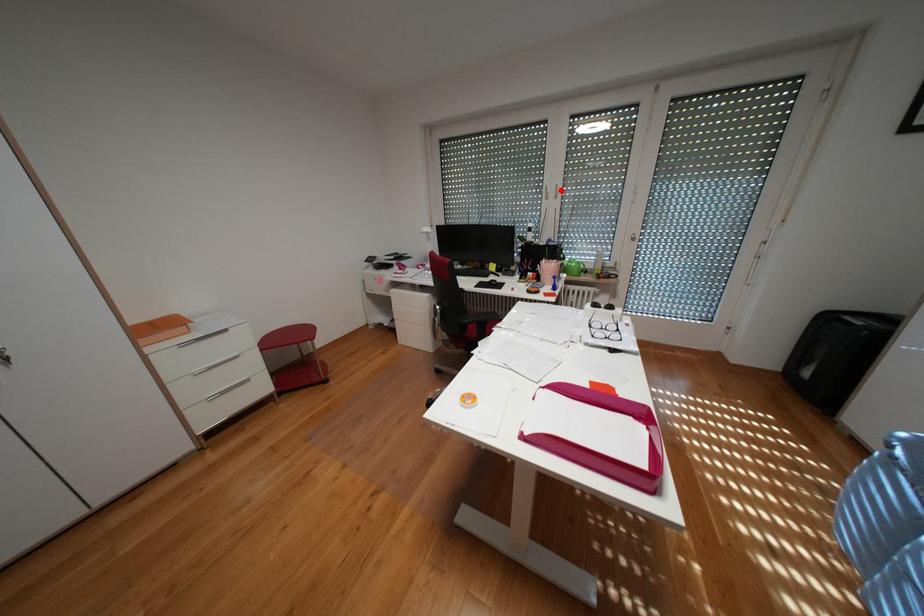
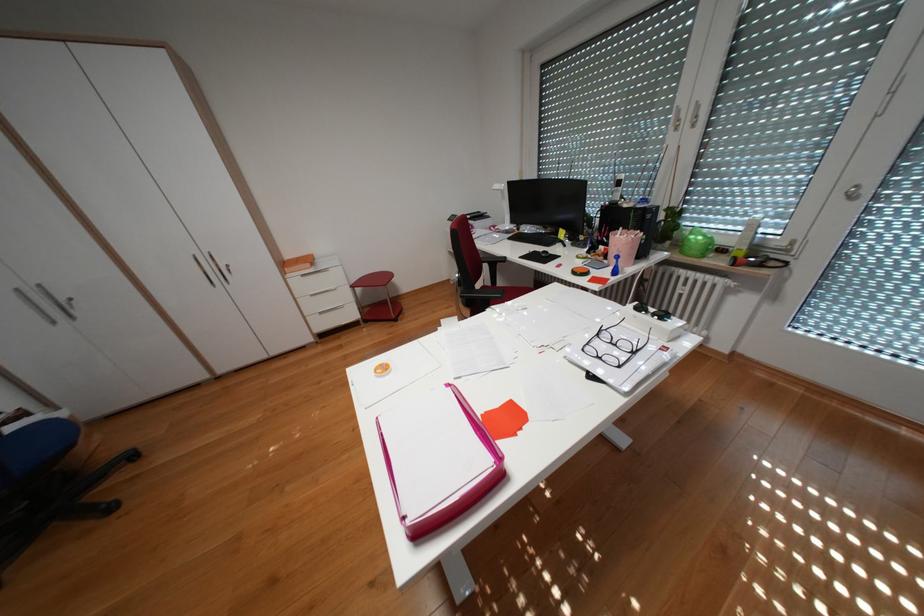
Find the pixel in the second image that matches the highlighted location in the first image.

(695, 116)